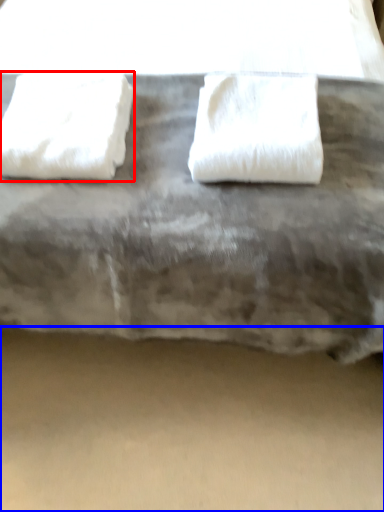
Question: Which of the following is the closest to the observer, towel (highlighted by a red box) or concrete (highlighted by a blue box)?

Choices:
 (A) towel
 (B) concrete

Answer: (A)